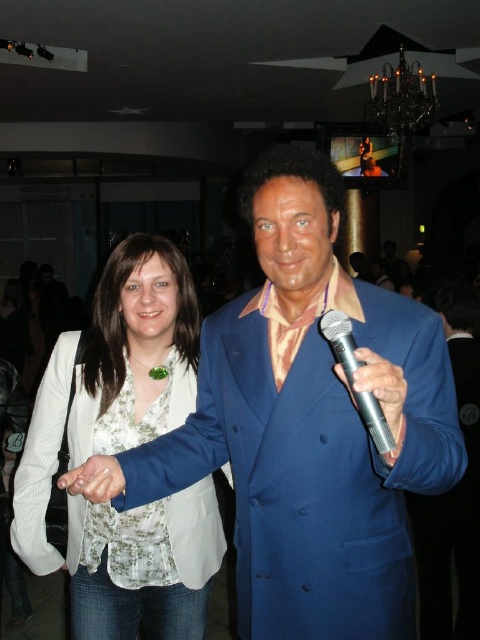
You are a photographer setting up for a group photo at the event. You need to position the blue velvet suit at center and the silver metallic microphone at right so that both are visible in the frame. Considering their sizes, which object should you ensure is closer to the camera to avoid being cut off?

The blue velvet suit at center is bigger than the silver metallic microphone at right, so you should position the silver metallic microphone at right closer to the camera to ensure it stays within the frame.

You are a photographer at the event and want to capture a photo where the white floral fabric dress at center and the white matte hand at center are both visible. Based on their positions, which one should you ensure is closer to the left side of the frame?

Result: The white floral fabric dress at center should be closer to the left side of the frame because it is positioned on the left side of the white matte hand at center.

You are a photographer setting up for a live performance. You need to ensure the white fabric blouse at center and the silver metallic microphone at right are both visible in the frame. Based on their positions, which object is closer to the camera?

The white fabric blouse at center is positioned under the silver metallic microphone at right, meaning the microphone is closer to the camera than the blouse.